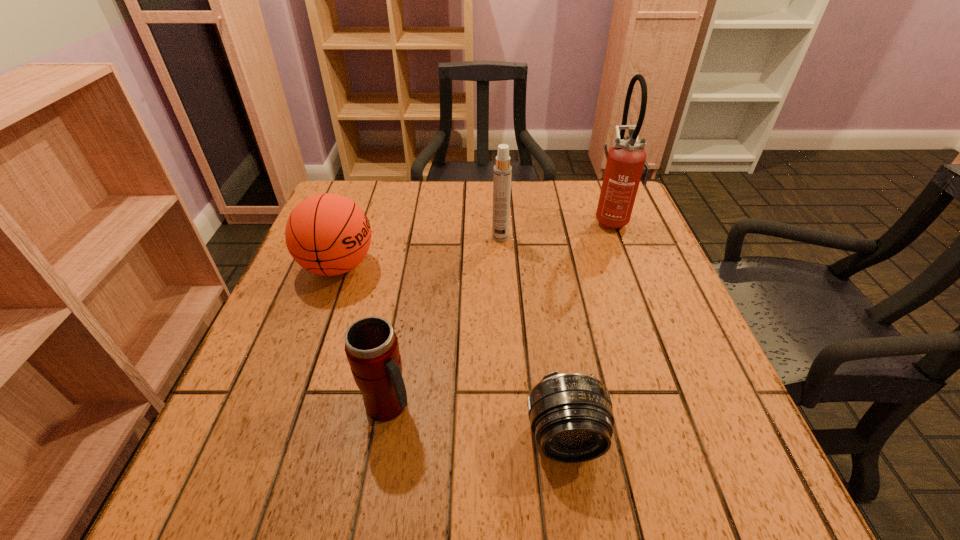
Where is `the rightmost object`? Image resolution: width=960 pixels, height=540 pixels. the rightmost object is located at coordinates (626, 165).

Where is `the tallest object`? Image resolution: width=960 pixels, height=540 pixels. the tallest object is located at coordinates coord(626,165).

Image resolution: width=960 pixels, height=540 pixels. In order to click on the fourth shortest object in this screenshot , I will do `click(502, 172)`.

Image resolution: width=960 pixels, height=540 pixels. I want to click on aerosol can, so click(x=502, y=172).

This screenshot has width=960, height=540. What are the coordinates of `thermos bottle` in the screenshot? It's located at (371, 346).

This screenshot has height=540, width=960. I want to click on the leftmost object, so click(327, 234).

Where is `the shortest object`? the shortest object is located at coordinates (571, 416).

Where is `the second object from right to left`? This screenshot has height=540, width=960. the second object from right to left is located at coordinates (571, 416).

Image resolution: width=960 pixels, height=540 pixels. I want to click on vacant area located at the nozzle of the rightmost object, so click(x=445, y=219).

The image size is (960, 540). Find the location of `vacant region located at the nozzle of the rightmost object`. vacant region located at the nozzle of the rightmost object is located at coordinates (471, 219).